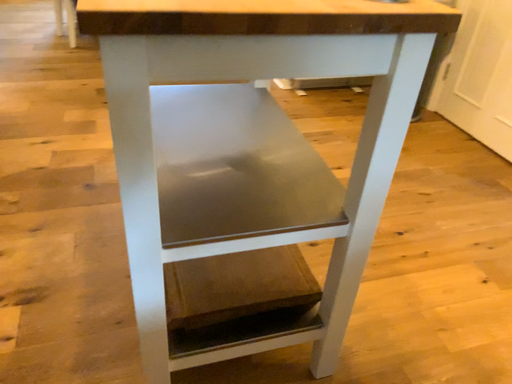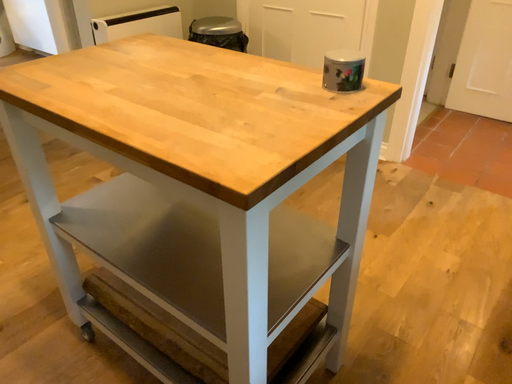
Question: How did the camera likely rotate when shooting the video?

Choices:
 (A) rotated left
 (B) rotated right

Answer: (B)